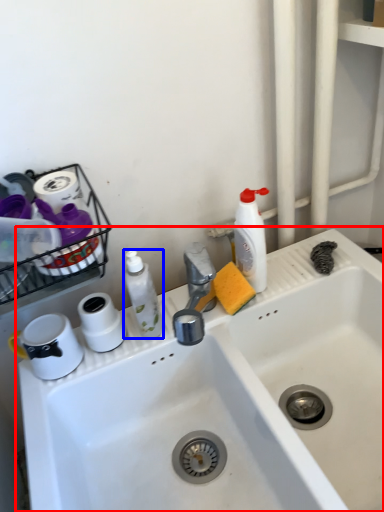
Question: Among these objects, which one is nearest to the camera, sink (highlighted by a red box) or cleaning product (highlighted by a blue box)?

Choices:
 (A) sink
 (B) cleaning product

Answer: (A)